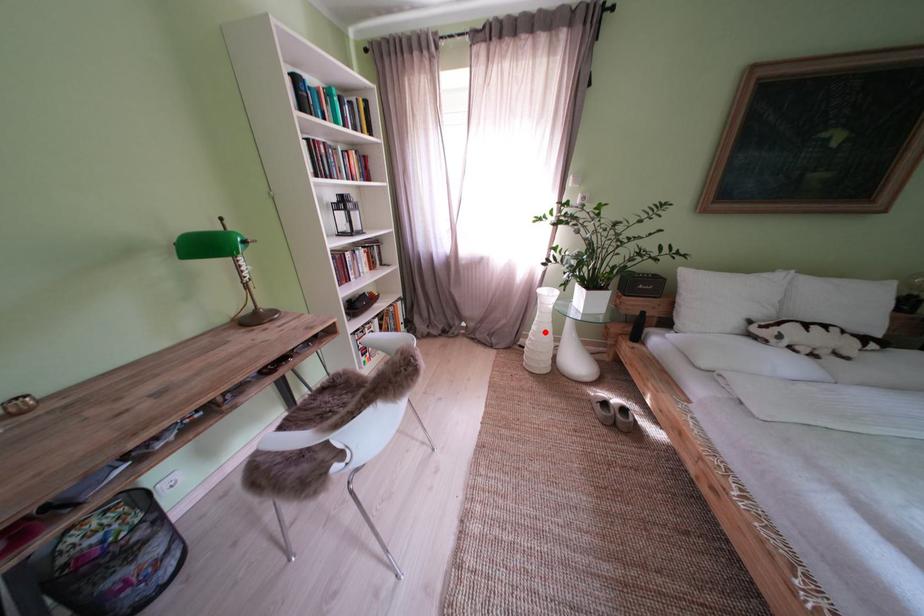
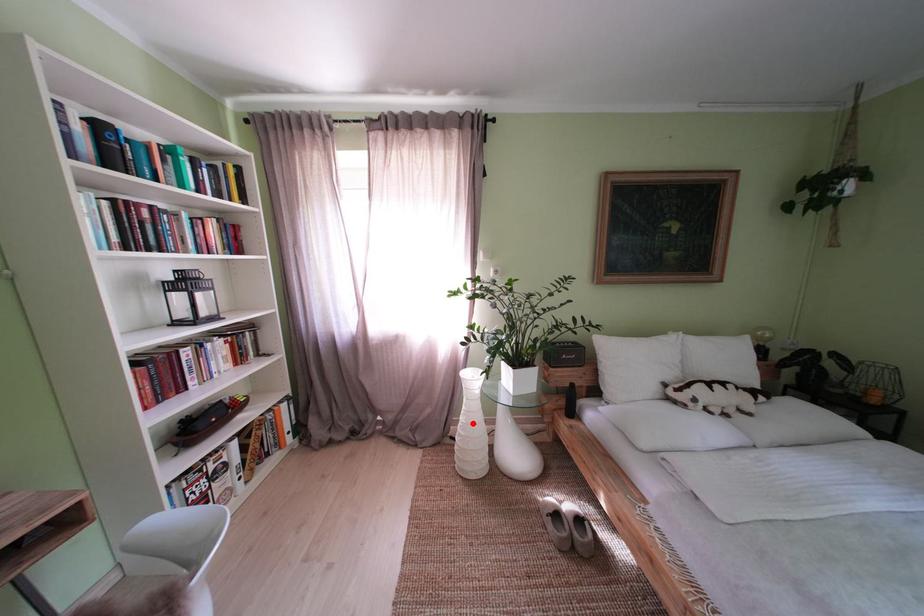
I am providing you with two images of the same scene from different viewpoints. A red point is marked on the first image and another point is marked on the second image. Is the red point in image1 aligned with the point shown in image2?

Yes